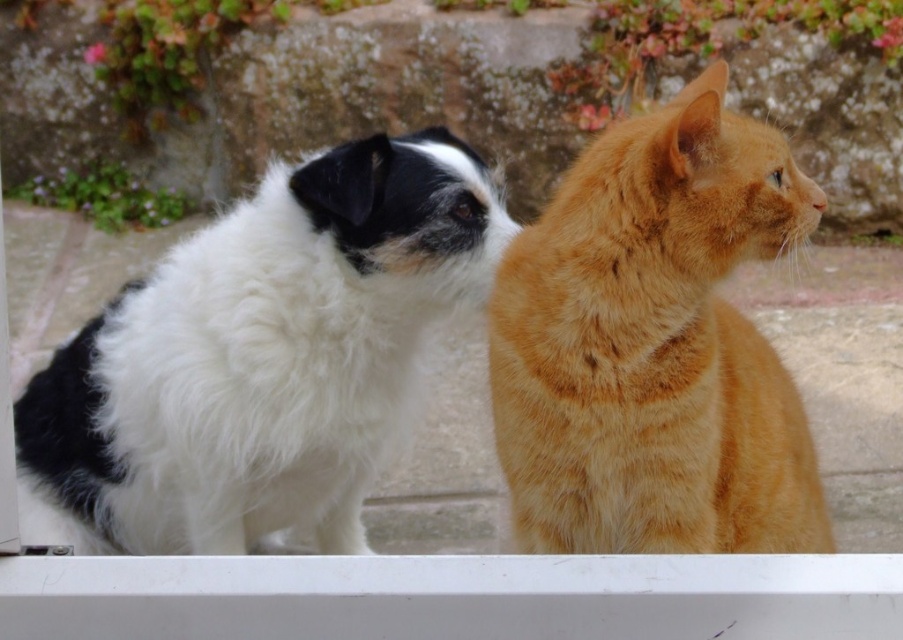
You are standing at the point marked as point (362, 241). You want to walk towards the dog on the left and the cat on the right. Which animal will you reach first?

Since the dog on the left and the cat on the right are 7.40 feet apart, you will reach the dog on the left first if you are moving towards it, and the cat on the right first if you are moving towards it. The question doesn

You are a photographer setting up a camera to take a group photo of the white fluffy dog at left and the orange fur cat at right. The minimum distance your camera requires between subjects to focus properly is 60 centimeters. Based on the scene, will the camera be able to focus on both animals?

The white fluffy dog at left and orange fur cat at right are 65.19 centimeters apart from each other. Since the required minimum distance is 60 centimeters, the camera can focus on both animals because the distance between them exceeds the required 60 centimeters.